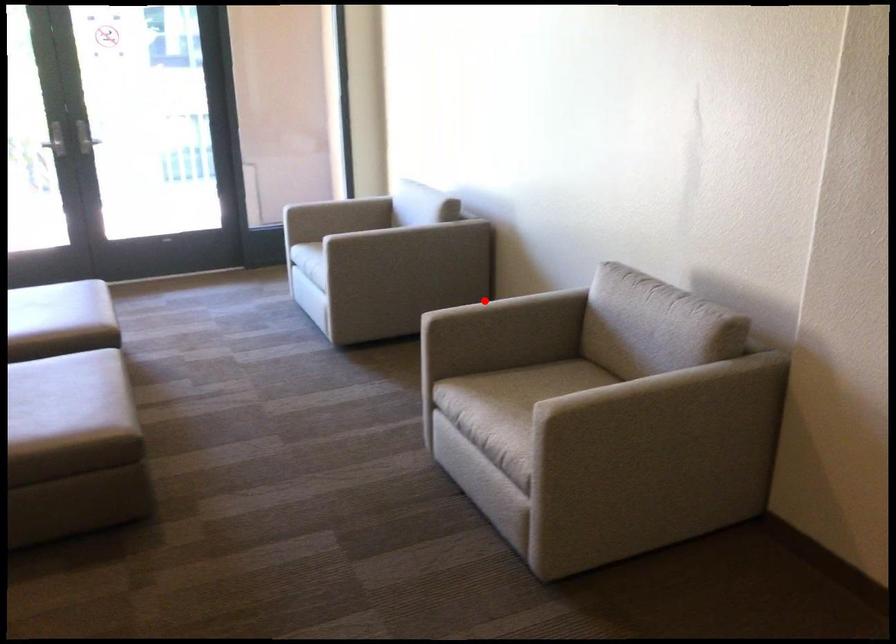
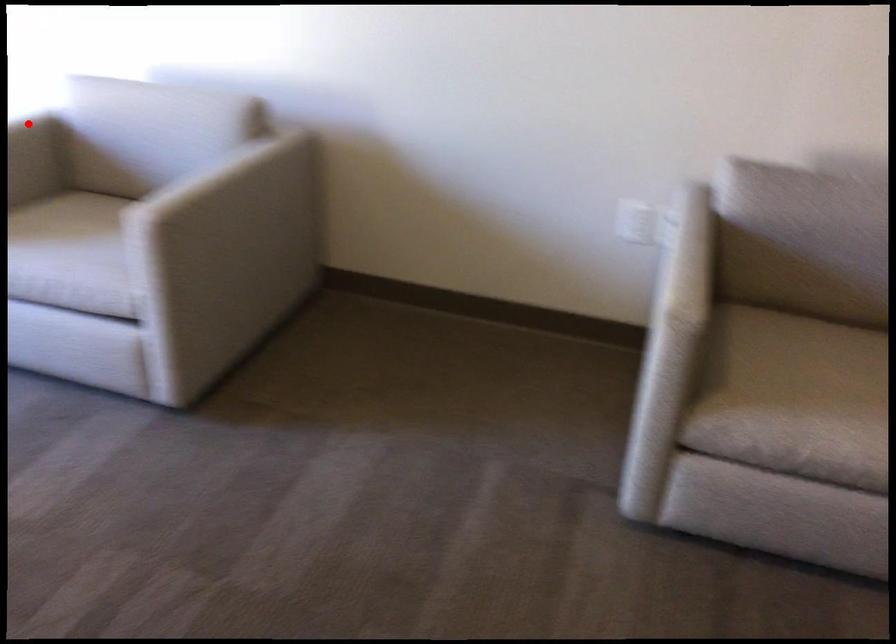
I am providing you with two images of the same scene from different viewpoints. A red point is marked on the first image and another point is marked on the second image. Is the marked point in image1 the same physical position as the marked point in image2?

No